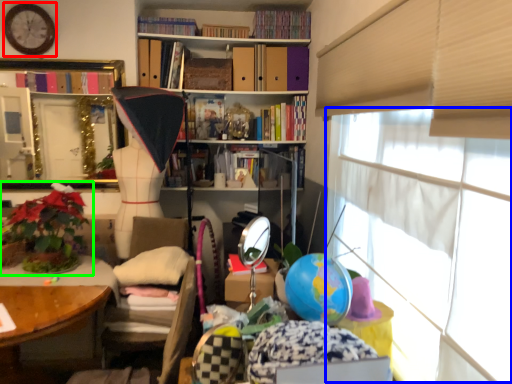
Question: Considering the real-world distances, which object is farthest from clock (highlighted by a red box)? window screen (highlighted by a blue box) or houseplant (highlighted by a green box)?

Choices:
 (A) window screen
 (B) houseplant

Answer: (A)